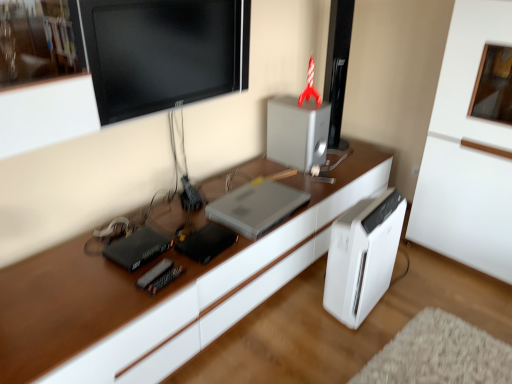
Image resolution: width=512 pixels, height=384 pixels. Identify the location of blank space to the left of white plastic air purifier at lower right. (304, 306).